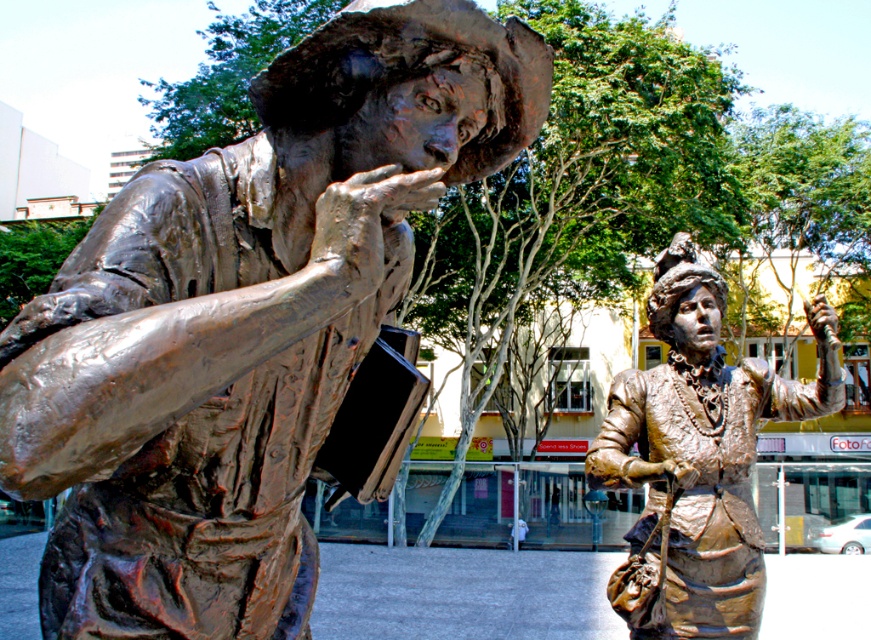
Consider the image. Is bronze statue at left shorter than bronze statue at right?

In fact, bronze statue at left may be taller than bronze statue at right.

Which is above, bronze statue at left or bronze statue at right?

Positioned higher is bronze statue at left.

The height and width of the screenshot is (640, 871). Identify the location of bronze statue at left. (244, 321).

Locate an element on the screen. This screenshot has height=640, width=871. bronze statue at left is located at coordinates (244, 321).